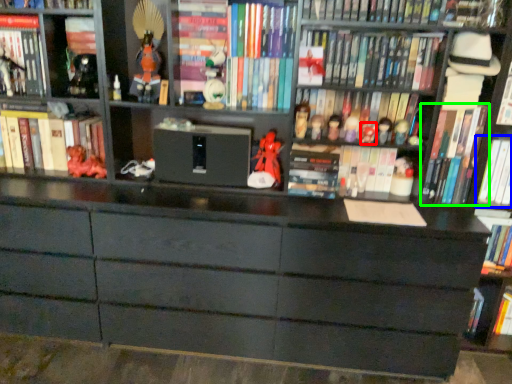
Question: Estimate the real-world distances between objects in this image. Which object is farther from toy (highlighted by a red box), book (highlighted by a blue box) or book (highlighted by a green box)?

Choices:
 (A) book
 (B) book

Answer: (A)